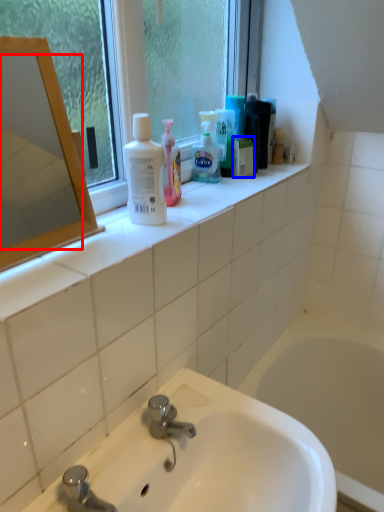
Question: Which point is closer to the camera, mirror (highlighted by a red box) or mouthwash (highlighted by a blue box)?

Choices:
 (A) mirror
 (B) mouthwash

Answer: (A)